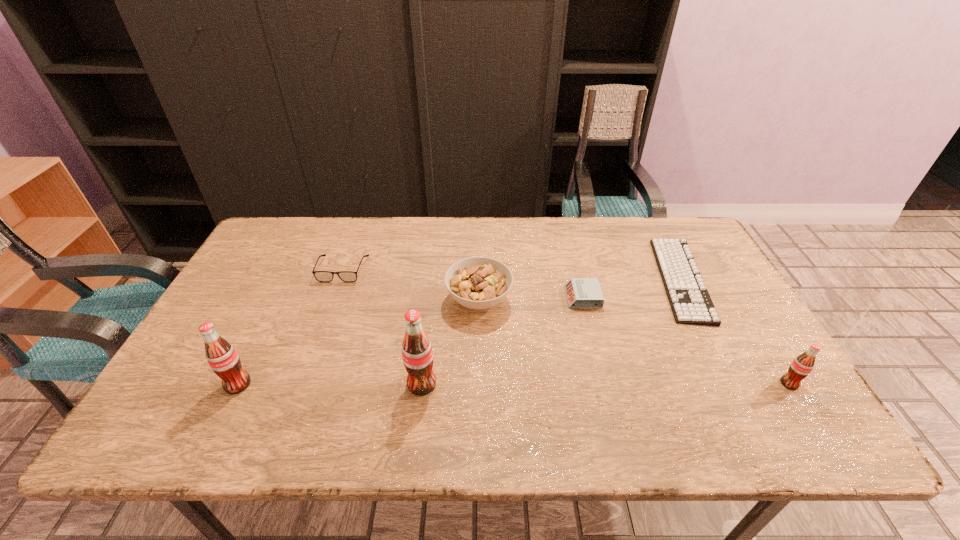
In the image, there is a desktop. Where is `vacant space at the right edge`? The width and height of the screenshot is (960, 540). vacant space at the right edge is located at coordinates (738, 364).

Where is `vacant space at the far left corner of the desktop`? The image size is (960, 540). vacant space at the far left corner of the desktop is located at coordinates (268, 229).

At what (x,y) coordinates should I click in order to perform the action: click on vacant region at the far right corner of the desktop. Please return your answer as a coordinate pair (x, y). The width and height of the screenshot is (960, 540). Looking at the image, I should click on (644, 224).

The width and height of the screenshot is (960, 540). In order to click on vacant area at the near right corner in this screenshot , I will do click(x=745, y=394).

Locate an element on the screen. free space between the second tallest object and the third shortest object is located at coordinates (290, 327).

Where is `unoccupied area between the second tallest soda and the stew`? unoccupied area between the second tallest soda and the stew is located at coordinates (358, 342).

You are a GUI agent. You are given a task and a screenshot of the screen. Output one action in this format:
    pyautogui.click(x=<x>, y=<y>)
    Task: Click on the vacant space in between the shortest object and the rightmost object
    
    Given the screenshot: What is the action you would take?
    pyautogui.click(x=735, y=332)

Identify the location of unoccupied area between the sixth tallest object and the computer keyboard. Image resolution: width=960 pixels, height=540 pixels. (632, 288).

I want to click on free point between the third tallest object and the third shortest object, so click(x=566, y=326).

At what (x,y) coordinates should I click in order to perform the action: click on free space between the second soda from right to left and the shortest soda. Please return your answer as a coordinate pair (x, y). The height and width of the screenshot is (540, 960). Looking at the image, I should click on click(x=606, y=383).